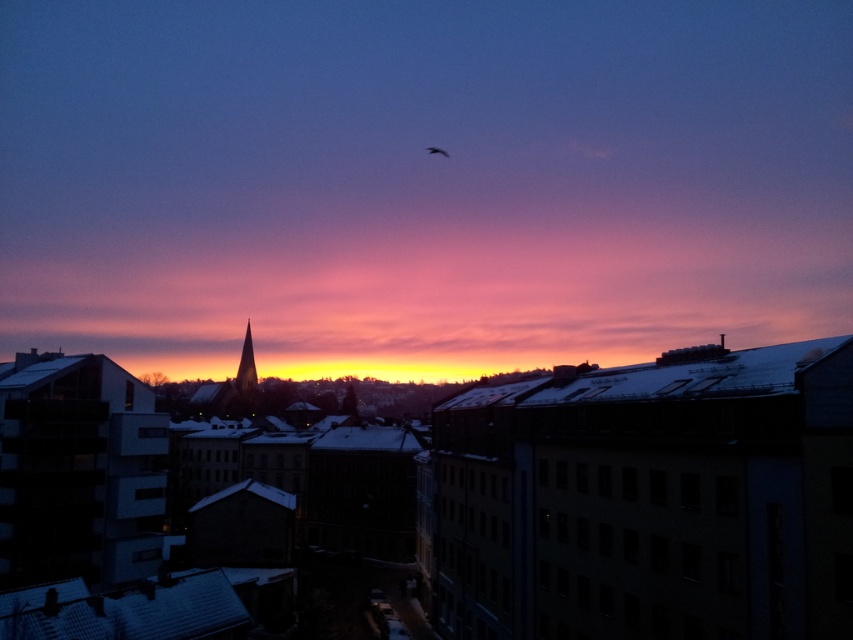
Can you confirm if golden glass spire at center is bigger than silvery metallic bird at upper center?

Yes, golden glass spire at center is bigger than silvery metallic bird at upper center.

Can you confirm if golden glass spire at center is positioned to the right of silvery metallic bird at upper center?

Incorrect, golden glass spire at center is not on the right side of silvery metallic bird at upper center.

Find the location of a particular element. golden glass spire at center is located at coordinates (247, 368).